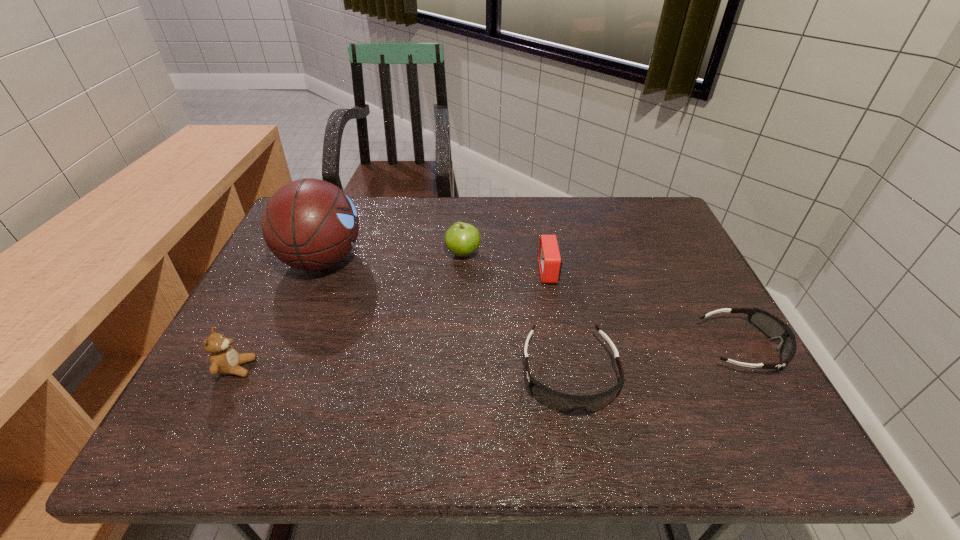
At what (x,y) coordinates should I click in order to perform the action: click on the taller goggles. Please return your answer as a coordinate pair (x, y). This screenshot has height=540, width=960. Looking at the image, I should click on (564, 403).

Locate an element on the screen. The image size is (960, 540). the left goggles is located at coordinates (564, 403).

I want to click on the rightmost object, so click(773, 327).

At what (x,y) coordinates should I click in order to perform the action: click on the shortest object. Please return your answer as a coordinate pair (x, y). The height and width of the screenshot is (540, 960). Looking at the image, I should click on (773, 327).

Where is `basketball`? basketball is located at coordinates (310, 224).

The image size is (960, 540). Identify the location of the fourth tallest object. (549, 258).

This screenshot has height=540, width=960. What are the coordinates of `the third object from left to right` in the screenshot? It's located at (462, 239).

What are the coordinates of `teddy bear` in the screenshot? It's located at (224, 359).

In order to click on vacant region located 0.320m on the right of the basketball in this screenshot , I will do `click(480, 260)`.

Identify the location of free spot located on the front-facing side of the fourth tallest object. This screenshot has width=960, height=540. (444, 272).